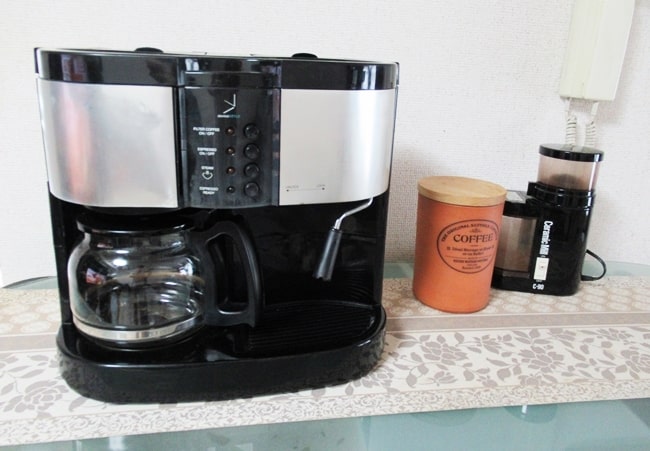
Locate an element on the screen. Image resolution: width=650 pixels, height=451 pixels. lights is located at coordinates (229, 132), (229, 151), (229, 170), (229, 190).